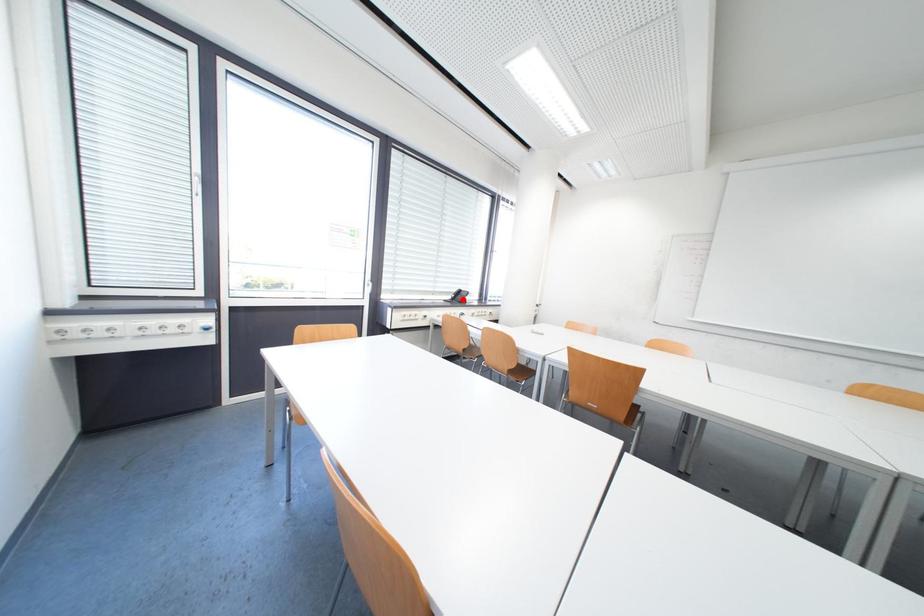
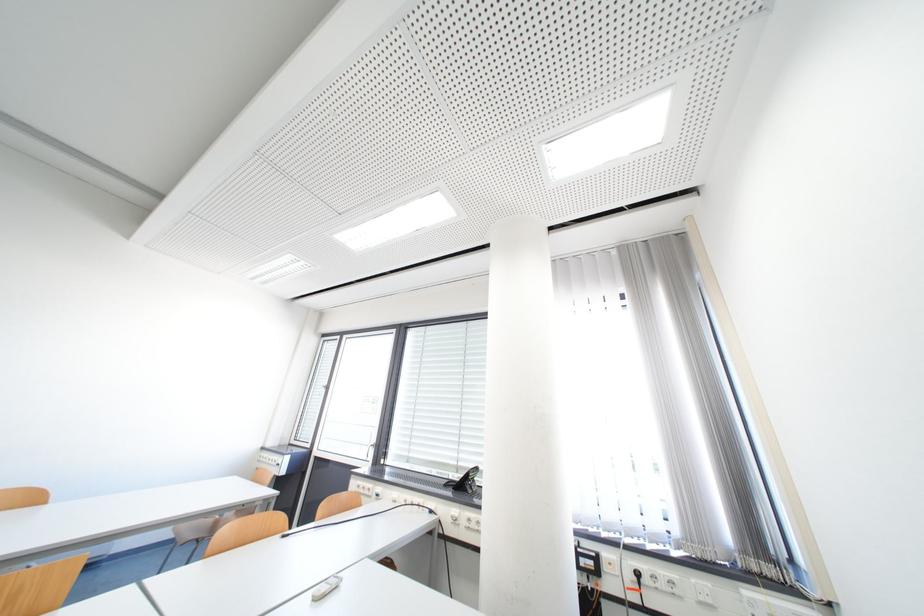
Question: I am providing you with two images of the same scene from different viewpoints. In image1, a red point is highlighted. Considering the same 3D point in image2, which of the following is correct?

Choices:
 (A) It is closer
 (B) It is farther

Answer: (B)